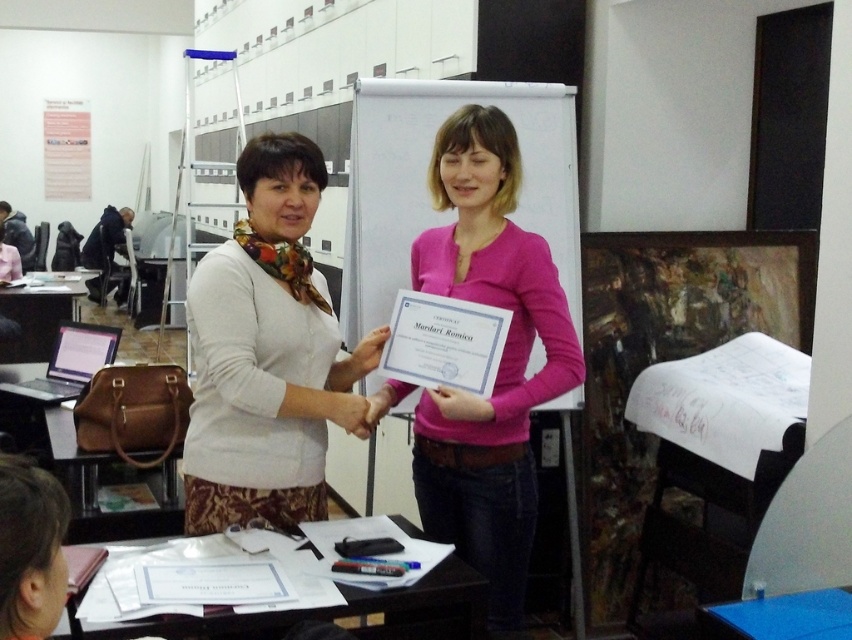
Question: Does white matte sweater at center appear on the right side of pink matte sweater at center?

Choices:
 (A) yes
 (B) no

Answer: (B)

Question: Which of the following is the closest to the observer?

Choices:
 (A) pink matte sweater at center
 (B) white matte sweater at center

Answer: (B)

Question: Does white matte sweater at center have a larger size compared to pink matte sweater at center?

Choices:
 (A) no
 (B) yes

Answer: (A)

Question: Which point appears closest to the camera in this image?

Choices:
 (A) (196, 336)
 (B) (505, 627)

Answer: (A)

Question: Does white matte sweater at center appear under pink matte sweater at center?

Choices:
 (A) yes
 (B) no

Answer: (B)